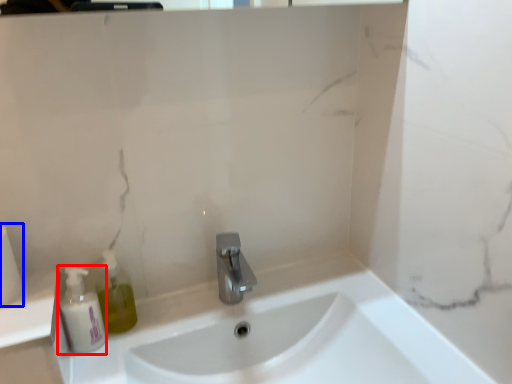
Question: Which object is further to the camera taking this photo, mouthwash (highlighted by a red box) or toilet paper (highlighted by a blue box)?

Choices:
 (A) mouthwash
 (B) toilet paper

Answer: (A)